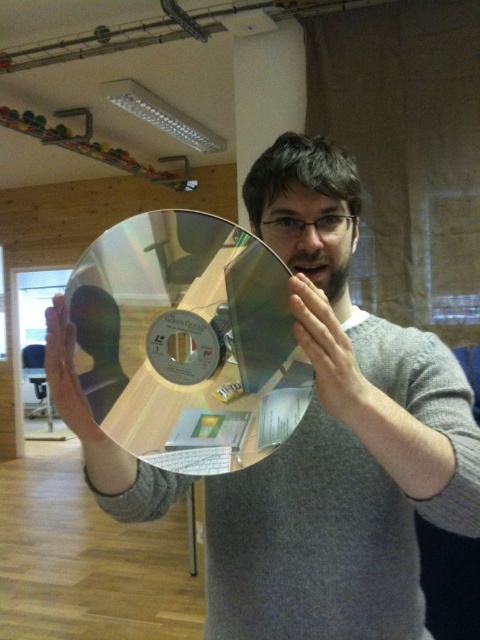
Measure the distance between point (395, 561) and camera.

Point (395, 561) is 31.31 inches from camera.

Does metallic silver disc at center appear on the left side of matte metallic face at center?

Yes, metallic silver disc at center is to the left of matte metallic face at center.

Between point (321, 260) and point (307, 218), which one is positioned behind?

Point (321, 260)

You are a GUI agent. You are given a task and a screenshot of the screen. Output one action in this format:
    pyautogui.click(x=<x>, y=<y>)
    Task: Click on the metallic silver disc at center
    The height and width of the screenshot is (640, 480).
    Given the screenshot: What is the action you would take?
    pyautogui.click(x=338, y=440)

Is metallic gold at center above matte gold disc at center?

Yes, metallic gold at center is above matte gold disc at center.

Is metallic gold at center thinner than matte gold disc at center?

Yes.

Measure the distance between point [324,298] and camera.

The distance of point [324,298] from camera is 24.16 inches.

Where is `metallic gold at center`? This screenshot has width=480, height=640. metallic gold at center is located at coordinates (330, 355).

In the scene shown: Can you confirm if matte metallic face at center is thinner than metallic gold at center?

No, matte metallic face at center is not thinner than metallic gold at center.

Find the location of `matte metallic face at center`. matte metallic face at center is located at coordinates (311, 236).

The height and width of the screenshot is (640, 480). Describe the element at coordinates (311, 236) in the screenshot. I see `matte metallic face at center` at that location.

Find the location of a particular element. This screenshot has height=640, width=480. matte metallic face at center is located at coordinates (311, 236).